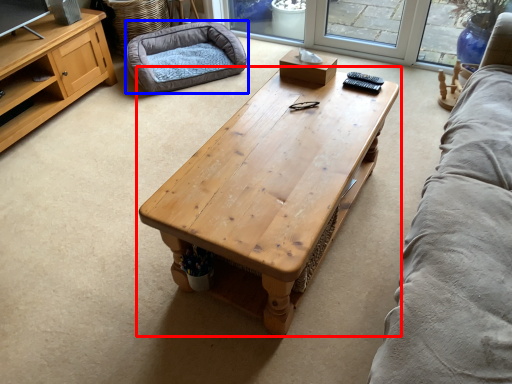
Question: Which of the following is the farthest to the observer, coffee table (highlighted by a red box) or dog bed (highlighted by a blue box)?

Choices:
 (A) coffee table
 (B) dog bed

Answer: (B)